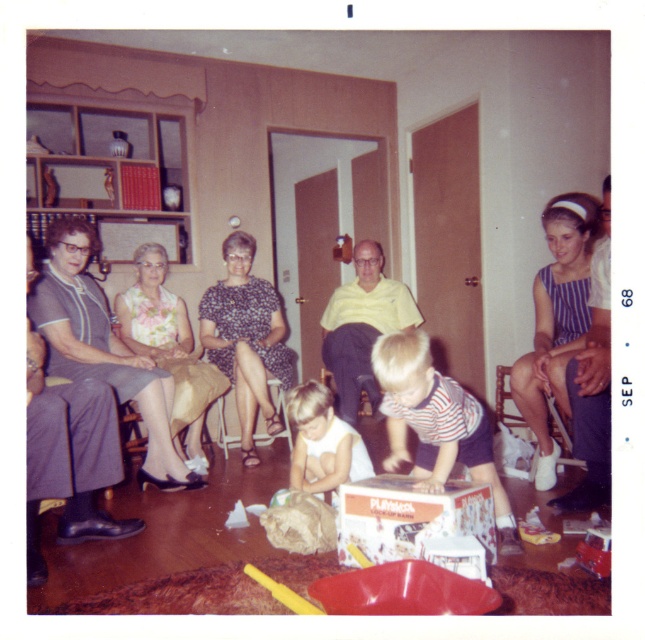
Consider the image. Does matte black dress at left have a lesser width compared to white cotton shirt at center?

In fact, matte black dress at left might be wider than white cotton shirt at center.

At what (x,y) coordinates should I click in order to perform the action: click on matte black dress at left. Please return your answer as a coordinate pair (x, y). The height and width of the screenshot is (640, 645). Looking at the image, I should click on (555, 332).

Which is more to the left, striped cotton shirt at center or printed fabric dress at center?

From the viewer's perspective, printed fabric dress at center appears more on the left side.

Which is below, striped cotton shirt at center or printed fabric dress at center?

striped cotton shirt at center is lower down.

Is point (402, 433) positioned in front of point (246, 465)?

Yes, it is.

At what (x,y) coordinates should I click in order to perform the action: click on striped cotton shirt at center. Please return your answer as a coordinate pair (x, y). The image size is (645, 640). Looking at the image, I should click on (437, 422).

Between point (362, 544) and point (355, 284), which one is positioned in front?

Point (362, 544) is in front.

Does white cardboard playmobil box at center appear under yellow matte shirt at center?

Indeed, white cardboard playmobil box at center is positioned under yellow matte shirt at center.

Is point (415, 529) farther from camera compared to point (333, 326)?

No, (415, 529) is closer to viewer.

This screenshot has width=645, height=640. I want to click on white cardboard playmobil box at center, so click(410, 516).